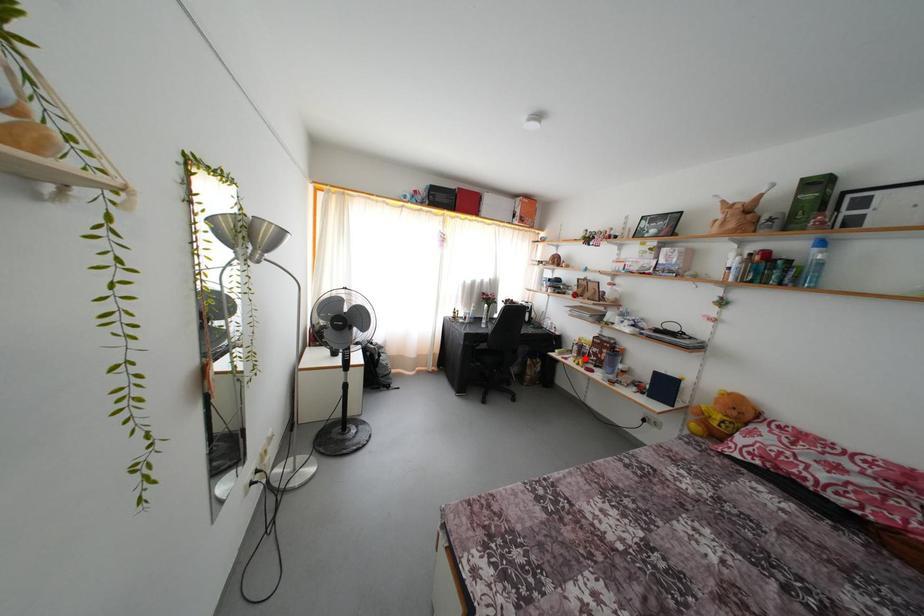
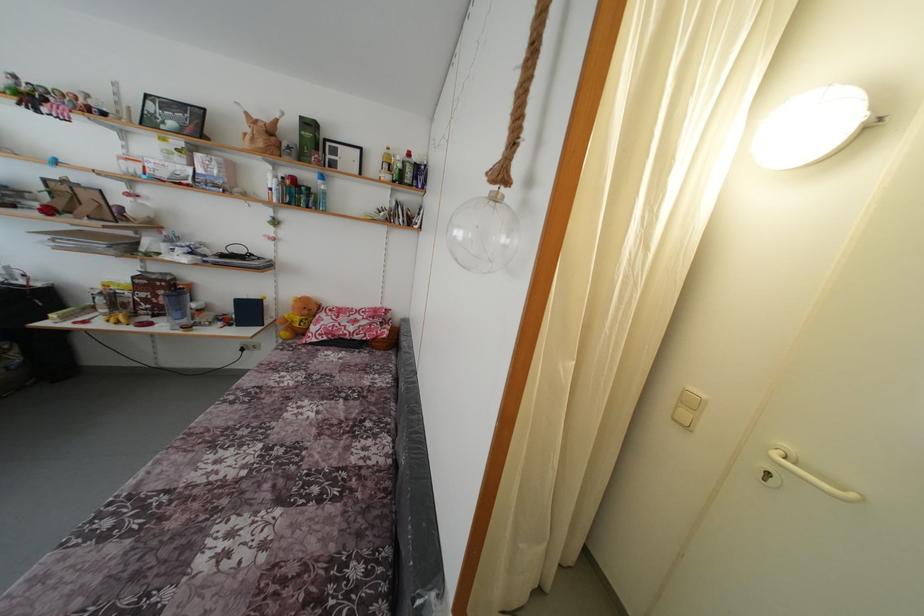
Locate, in the second image, the point that corresponds to the highlighted location in the first image.

(120, 310)